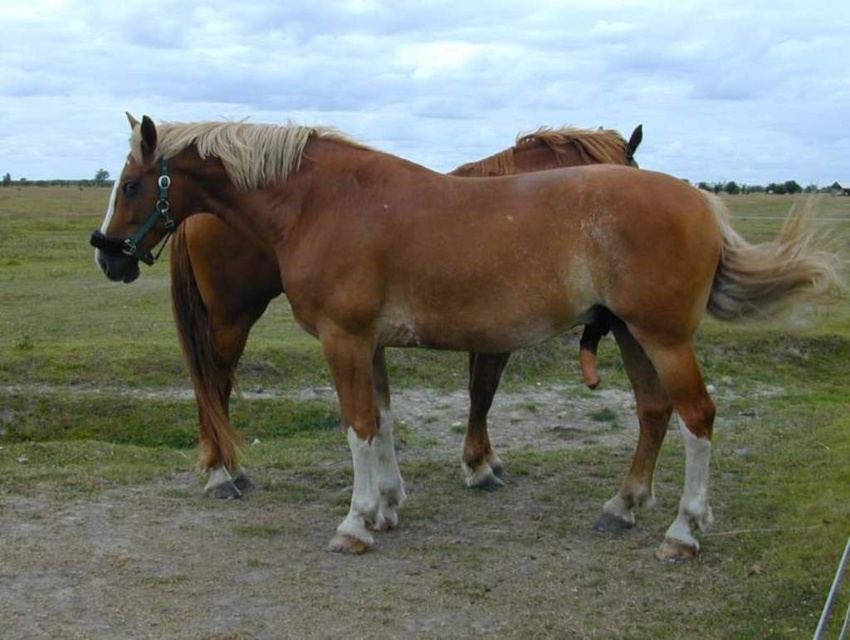
Question: Can you confirm if brown glossy horse at center is bigger than blonde silky tail at right?

Choices:
 (A) no
 (B) yes

Answer: (A)

Question: Considering the relative positions of brown glossy horse at center and blonde silky tail at right in the image provided, where is brown glossy horse at center located with respect to blonde silky tail at right?

Choices:
 (A) right
 (B) left

Answer: (B)

Question: Which of the following is the farthest from the observer?

Choices:
 (A) brown glossy horse at center
 (B) blonde silky tail at right

Answer: (A)

Question: Is brown glossy horse at center behind blonde silky tail at right?

Choices:
 (A) no
 (B) yes

Answer: (B)

Question: Which of the following is the farthest from the observer?

Choices:
 (A) brown glossy horse at center
 (B) blonde silky tail at right

Answer: (A)